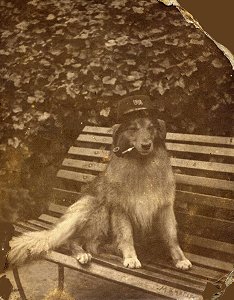
Where is `bench`? The width and height of the screenshot is (234, 300). bench is located at coordinates (207, 175).